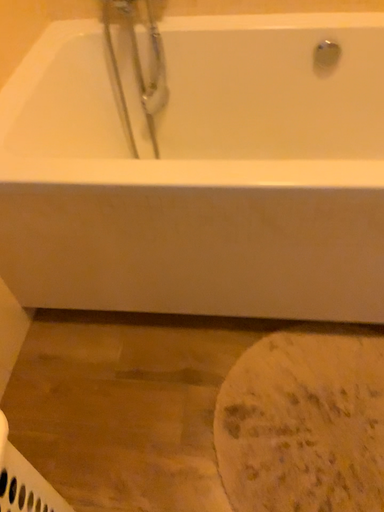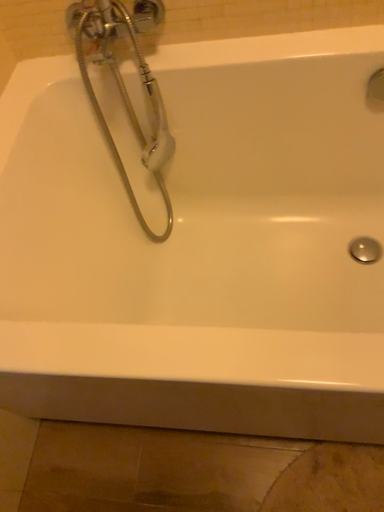
Question: Which way did the camera rotate in the video?

Choices:
 (A) rotated upward
 (B) rotated downward

Answer: (B)